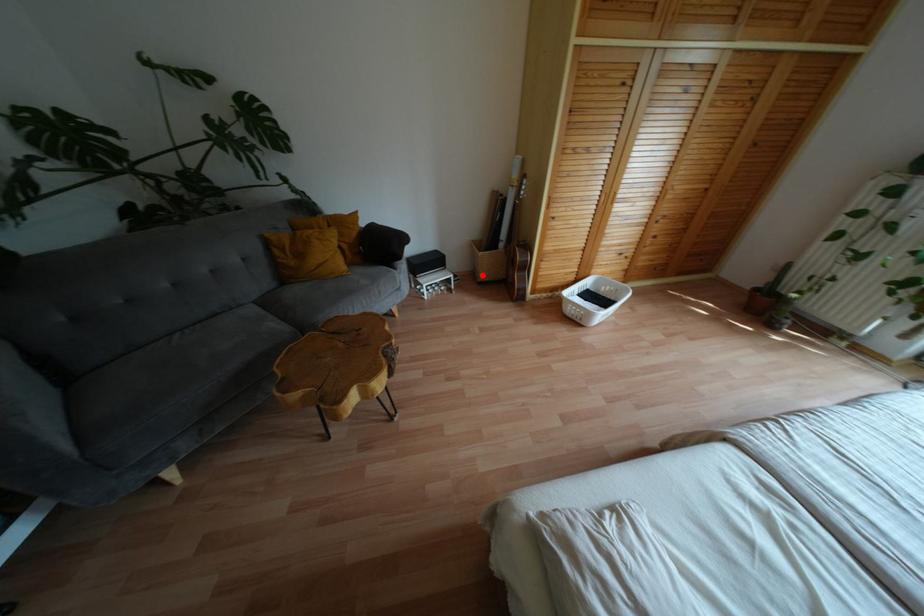
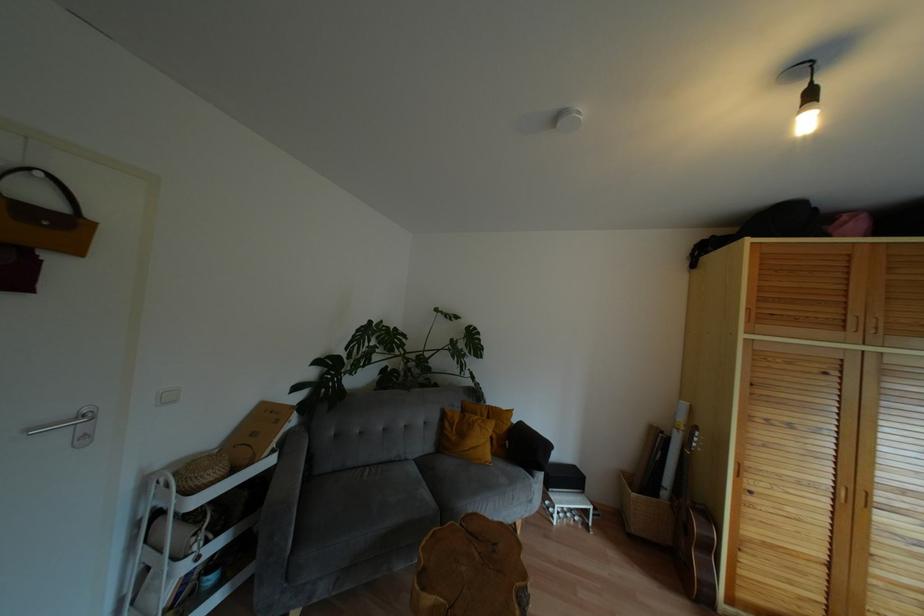
In the second image, find the point that corresponds to the highlighted location in the first image.

(636, 527)